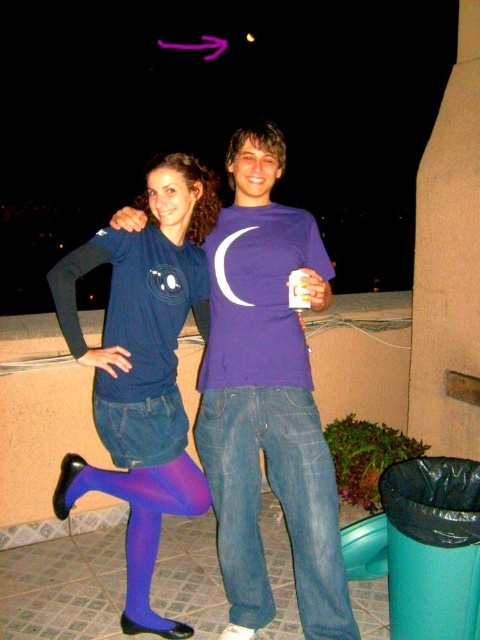
You are a photographer trying to capture a closeup shot of both the purple tights at center and the jeans at center in the image. Given that your camera has a minimum focus distance of 12 inches, will you be able to focus on both subjects simultaneously?

The distance between the purple tights at center and jeans at center is 13.89 inches, which is greater than the camera minimum focus distance of 12 inches. Therefore, the camera can focus on both subjects simultaneously as they are within the required distance range.